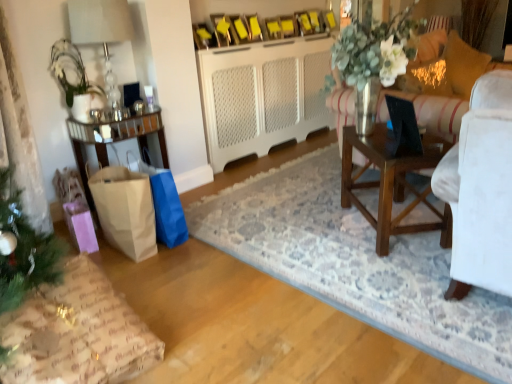
Question: From the image's perspective, does wrapping paper gift at lower left appear higher than brown paper bag at lower left, the 1th shopping bag positioned from the left?

Choices:
 (A) no
 (B) yes

Answer: (A)

Question: Can you confirm if wrapping paper gift at lower left is smaller than brown paper bag at lower left, the 2th shopping bag when ordered from right to left?

Choices:
 (A) yes
 (B) no

Answer: (B)

Question: Does wrapping paper gift at lower left contain brown paper bag at lower left, the 2th shopping bag when ordered from right to left?

Choices:
 (A) yes
 (B) no

Answer: (B)

Question: Is wrapping paper gift at lower left beside brown paper bag at lower left, the 2th shopping bag when ordered from right to left?

Choices:
 (A) yes
 (B) no

Answer: (B)

Question: Can you confirm if wrapping paper gift at lower left is taller than brown paper bag at lower left, the 1th shopping bag positioned from the left?

Choices:
 (A) no
 (B) yes

Answer: (A)

Question: Is wrapping paper gift at lower left positioned beyond the bounds of brown paper bag at lower left, the 2th shopping bag when ordered from right to left?

Choices:
 (A) yes
 (B) no

Answer: (A)

Question: Is brown wooden table at center, the second table in the left-to-right sequence, surrounding white textured cabinet at center?

Choices:
 (A) no
 (B) yes

Answer: (A)

Question: Could you tell me if brown wooden table at center, which ranks as the 1th table in right-to-left order, is facing white textured cabinet at center?

Choices:
 (A) no
 (B) yes

Answer: (A)

Question: From a real-world perspective, is brown wooden table at center, which ranks as the 1th table in right-to-left order, below white textured cabinet at center?

Choices:
 (A) yes
 (B) no

Answer: (A)

Question: Is the position of brown wooden table at center, the second table in the left-to-right sequence, more distant than that of white textured cabinet at center?

Choices:
 (A) yes
 (B) no

Answer: (B)

Question: Is brown wooden table at center, the second table in the left-to-right sequence, facing away from white textured cabinet at center?

Choices:
 (A) yes
 (B) no

Answer: (B)

Question: From the image's perspective, is brown wooden table at center, the second table in the left-to-right sequence, below white textured cabinet at center?

Choices:
 (A) no
 (B) yes

Answer: (B)

Question: Does black plastic laptop at right come behind gold textured pillow at upper right, which appears as the 2th pillow when viewed from the left?

Choices:
 (A) yes
 (B) no

Answer: (B)